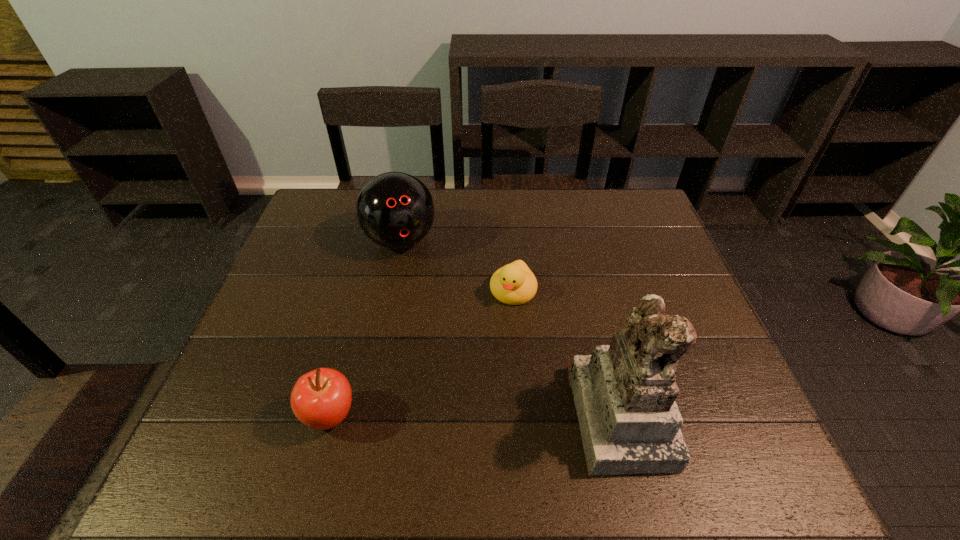
Image resolution: width=960 pixels, height=540 pixels. I want to click on vacant space at the left edge of the desktop, so click(x=238, y=375).

Where is `vacant space at the right edge of the desktop`? The height and width of the screenshot is (540, 960). vacant space at the right edge of the desktop is located at coordinates (646, 233).

This screenshot has width=960, height=540. Find the location of `free space at the far left corner of the desktop`. free space at the far left corner of the desktop is located at coordinates (323, 215).

Locate an element on the screen. vacant point at the near left corner is located at coordinates click(x=234, y=401).

The height and width of the screenshot is (540, 960). I want to click on vacant space at the far right corner of the desktop, so click(x=626, y=225).

This screenshot has width=960, height=540. In the image, there is a desktop. In order to click on vacant space at the near right corner in this screenshot , I will do `click(696, 418)`.

You are a GUI agent. You are given a task and a screenshot of the screen. Output one action in this format:
    pyautogui.click(x=<x>, y=<y>)
    Task: Click on the vacant space in between the figurine and the bowling ball
    
    Given the screenshot: What is the action you would take?
    pyautogui.click(x=510, y=327)

What are the coordinates of `unoccupied position between the apple and the figurine` in the screenshot? It's located at (474, 415).

The width and height of the screenshot is (960, 540). I want to click on vacant region between the third tallest object and the duckling, so click(x=421, y=353).

Find the location of `free space between the second tallest object and the figurine`. free space between the second tallest object and the figurine is located at coordinates (510, 327).